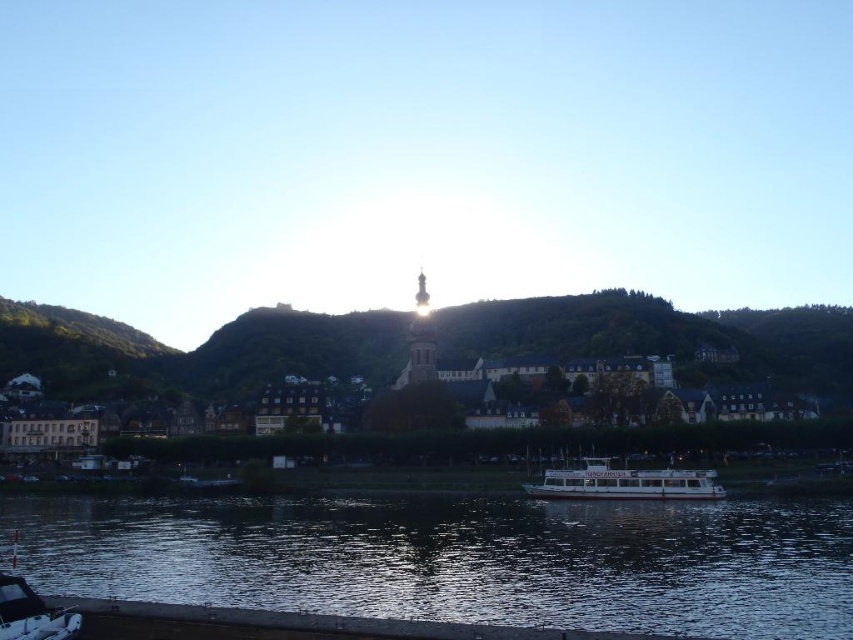
Image resolution: width=853 pixels, height=640 pixels. Describe the element at coordinates (624, 483) in the screenshot. I see `white glossy boat at lower center` at that location.

What do you see at coordinates (624, 483) in the screenshot? I see `white glossy boat at lower center` at bounding box center [624, 483].

This screenshot has height=640, width=853. What are the coordinates of `white glossy boat at lower center` in the screenshot? It's located at (624, 483).

Does point (593, 548) lie behind point (370, 419)?

No, (593, 548) is closer to viewer.

Can you confirm if dark reflective water at lower center is positioned to the right of matte stone buildings at center?

Yes, dark reflective water at lower center is to the right of matte stone buildings at center.

Between point (656, 561) and point (503, 436), which one is positioned behind?

The point (503, 436) is behind.

This screenshot has width=853, height=640. Identify the location of dark reflective water at lower center. (460, 557).

Which is above, dark reflective water at lower center or white glossy boat at lower center?

Positioned higher is white glossy boat at lower center.

Is dark reflective water at lower center bigger than white glossy boat at lower center?

Indeed, dark reflective water at lower center has a larger size compared to white glossy boat at lower center.

Is point (96, 570) more distant than point (566, 484)?

No, it is in front of (566, 484).

You are a GUI agent. You are given a task and a screenshot of the screen. Output one action in this format:
    pyautogui.click(x=<x>, y=<y>)
    Task: Click on the dark reflective water at lower center
    
    Given the screenshot: What is the action you would take?
    pyautogui.click(x=460, y=557)